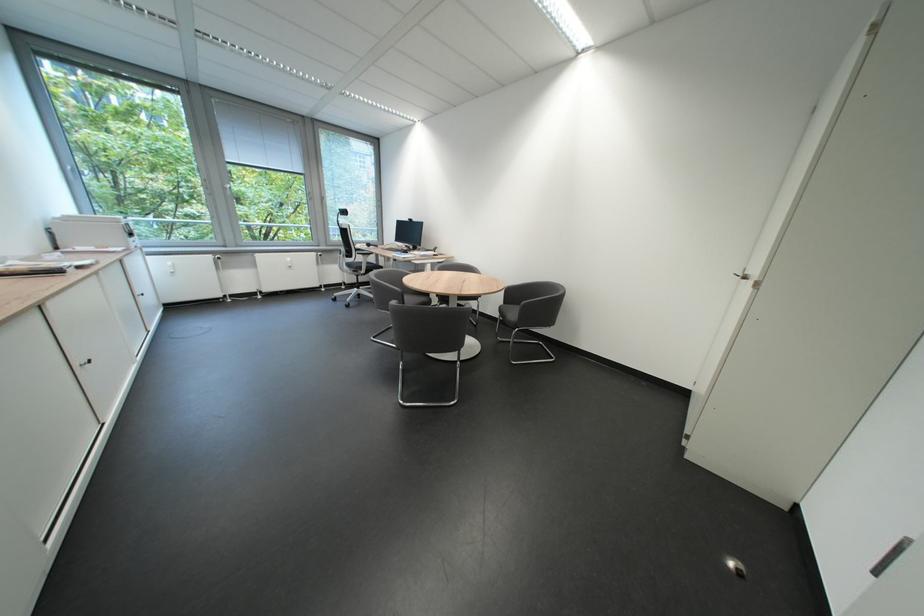
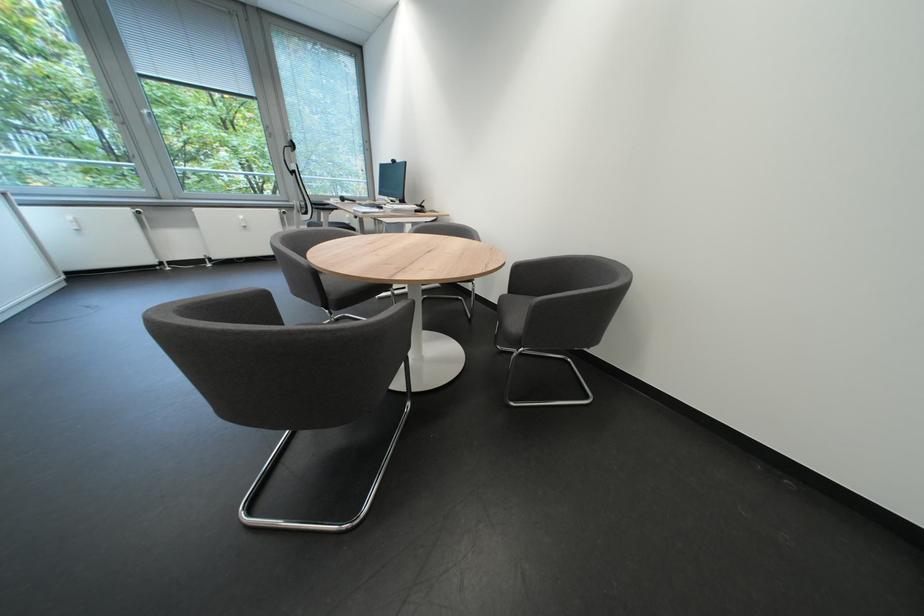
The point at (262, 197) is marked in the first image. Where is the corresponding point in the second image?

(248, 146)